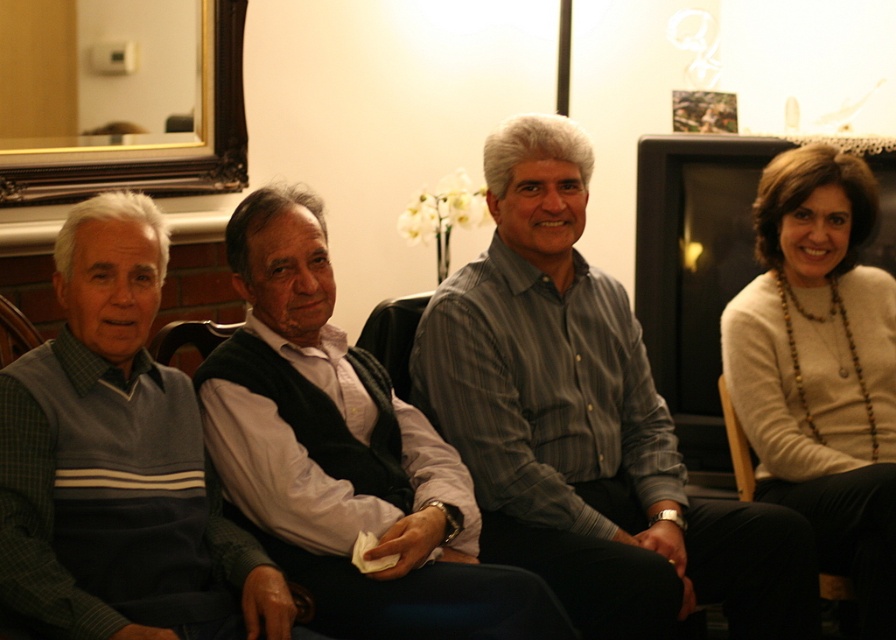
Question: Which object is positioned closest to the green sweater at left?

Choices:
 (A) wooden chair at right
 (B) white sweater at right

Answer: (B)

Question: Is gray striped shirt at center positioned at the back of white shirt at center?

Choices:
 (A) yes
 (B) no

Answer: (A)

Question: Which of the following is the closest to the observer?

Choices:
 (A) (840, 593)
 (B) (61, 349)

Answer: (B)

Question: Which of the following is the farthest from the observer?

Choices:
 (A) wooden chair at left
 (B) gray striped shirt at center
 (C) white sweater at right
 (D) white shirt at center

Answer: (A)

Question: Observing the image, what is the correct spatial positioning of white shirt at center in reference to wooden chair at left?

Choices:
 (A) right
 (B) left

Answer: (A)

Question: Is white shirt at center positioned at the back of green sweater at left?

Choices:
 (A) yes
 (B) no

Answer: (A)